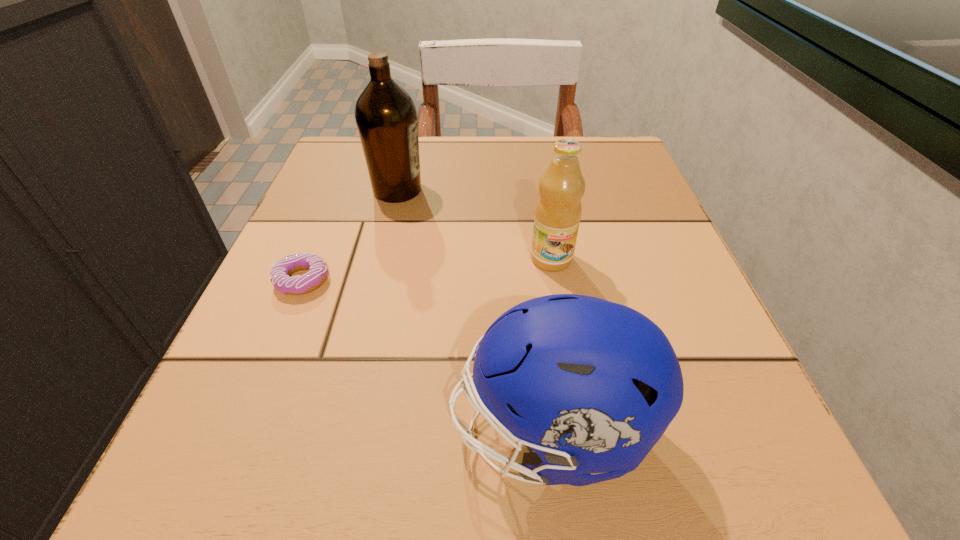
I want to click on vacant space at the far edge, so click(421, 186).

Where is `vacant space at the near edge`? vacant space at the near edge is located at coordinates (610, 489).

Find the location of a particular element. The image size is (960, 540). free region at the left edge of the desktop is located at coordinates (309, 349).

At what (x,y) coordinates should I click in order to perform the action: click on vacant space at the right edge of the desktop. Please return your answer as a coordinate pair (x, y). The image size is (960, 540). Looking at the image, I should click on (606, 295).

At what (x,y) coordinates should I click in order to perform the action: click on vacant space at the far left corner. Please return your answer as a coordinate pair (x, y). Image resolution: width=960 pixels, height=540 pixels. Looking at the image, I should click on (338, 152).

In the image, there is a desktop. Where is `free space at the near right corner`? free space at the near right corner is located at coordinates (786, 492).

What are the coordinates of `free space that is in between the leftmost object and the shorter olive oil` in the screenshot? It's located at (427, 269).

You are a GUI agent. You are given a task and a screenshot of the screen. Output one action in this format:
    pyautogui.click(x=<x>, y=<y>)
    Task: Click on the vacant area that lies between the leftmost object and the nearer olive oil
    The image size is (960, 540).
    Given the screenshot: What is the action you would take?
    pyautogui.click(x=427, y=269)

Identify the location of free space that is in between the taller olive oil and the football helmet. The height and width of the screenshot is (540, 960). (473, 310).

You are a GUI agent. You are given a task and a screenshot of the screen. Output one action in this format:
    pyautogui.click(x=<x>, y=<y>)
    Task: Click on the vacant space that's between the doughnut and the left olive oil
    The width and height of the screenshot is (960, 540).
    Given the screenshot: What is the action you would take?
    pyautogui.click(x=350, y=235)